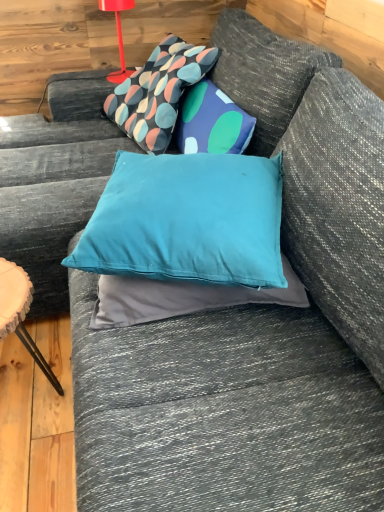
Question: Is patterned fabric pillow at upper center, which appears as the first pillow when viewed from the top, wider or thinner than matte red table lamp at upper left?

Choices:
 (A) wide
 (B) thin

Answer: (A)

Question: From a real-world perspective, is patterned fabric pillow at upper center, which appears as the first pillow when viewed from the top, physically located above or below matte red table lamp at upper left?

Choices:
 (A) above
 (B) below

Answer: (B)

Question: Which object is the farthest from the patterned fabric pillow at upper center, the 2th pillow ordered from the bottom?

Choices:
 (A) wooden side table at lower left
 (B) teal fabric pillow at center, which is the second pillow in back-to-front order
 (C) matte red table lamp at upper left

Answer: (A)

Question: Which is farther from the patterned fabric pillow at upper center, the first pillow positioned from the back?

Choices:
 (A) matte red table lamp at upper left
 (B) wooden side table at lower left
 (C) teal fabric pillow at center, which is the 1th pillow in bottom-to-top order

Answer: (B)